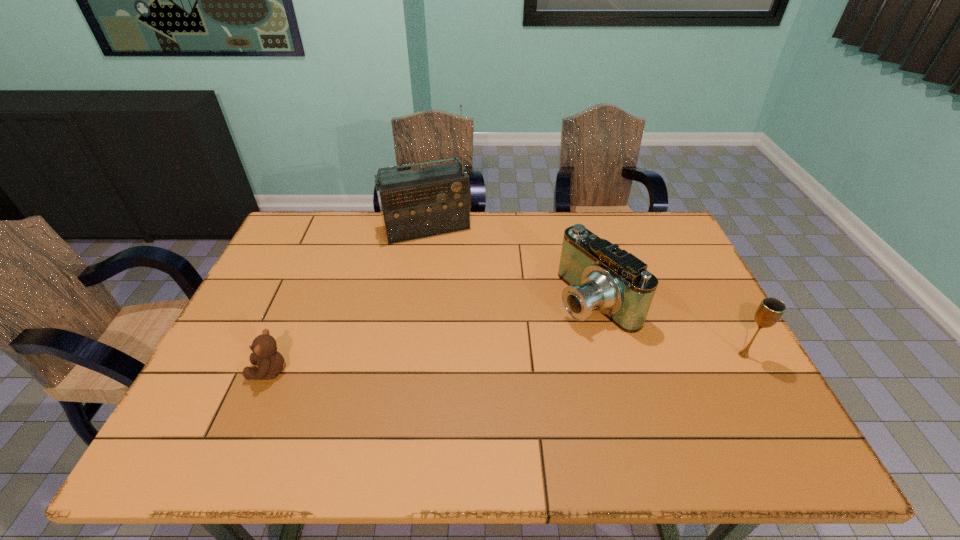
You are a GUI agent. You are given a task and a screenshot of the screen. Output one action in this format:
    pyautogui.click(x=<x>, y=<y>)
    Task: Click on the free space that satisfies the following two spatial constraints: 1. on the front side of the farthest object; 2. on the right side of the rightmost object
    Image resolution: width=960 pixels, height=540 pixels.
    Given the screenshot: What is the action you would take?
    pyautogui.click(x=407, y=355)